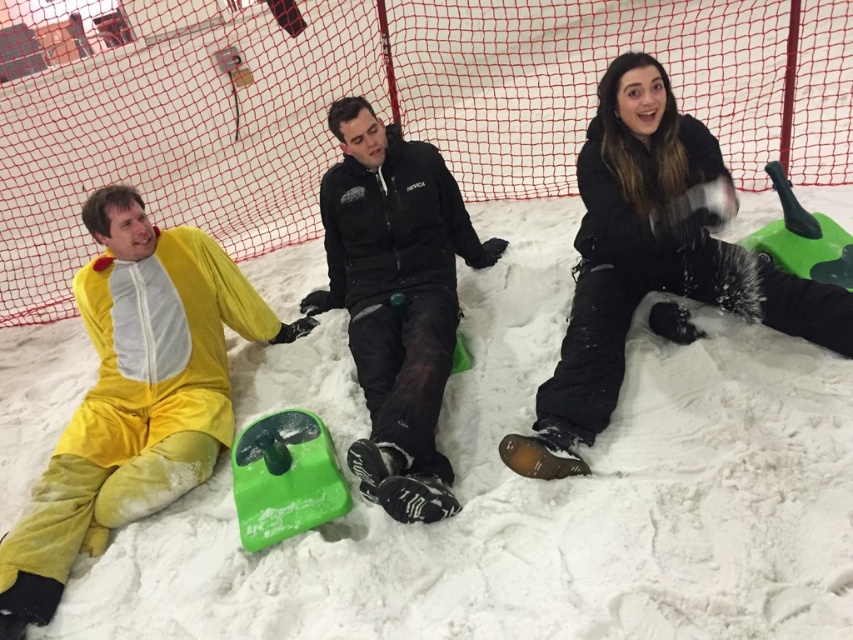
Question: Which point is closer to the camera taking this photo?

Choices:
 (A) (381, 209)
 (B) (270, 339)

Answer: (A)

Question: Does net at center have a greater width compared to black matte jacket at center?

Choices:
 (A) no
 (B) yes

Answer: (B)

Question: Can you confirm if yellow plush onesie at left is thinner than matte black jacket at upper right?

Choices:
 (A) no
 (B) yes

Answer: (B)

Question: Is the position of yellow plush onesie at left less distant than that of black matte jacket at center?

Choices:
 (A) yes
 (B) no

Answer: (A)

Question: Estimate the real-world distances between objects in this image. Which object is farther from the white fluffy snow at center?

Choices:
 (A) net at center
 (B) matte black jacket at upper right

Answer: (A)

Question: Among these objects, which one is farthest from the camera?

Choices:
 (A) matte black jacket at upper right
 (B) black matte jacket at center

Answer: (A)